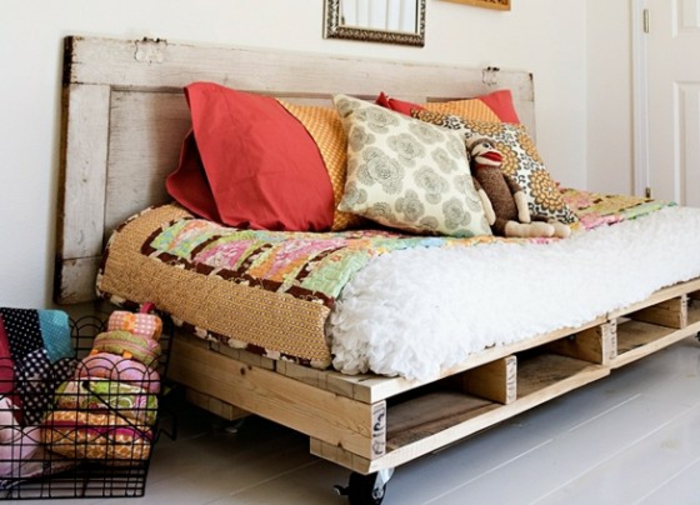
Where is `caster wheel`? The height and width of the screenshot is (505, 700). caster wheel is located at coordinates (364, 481).